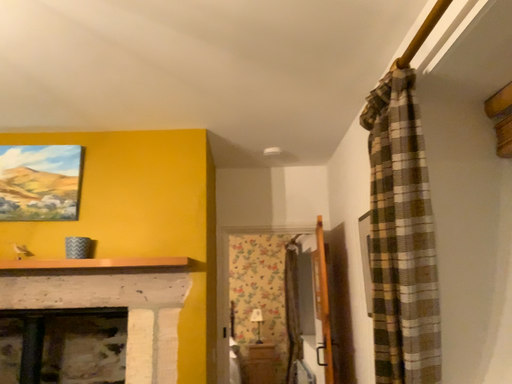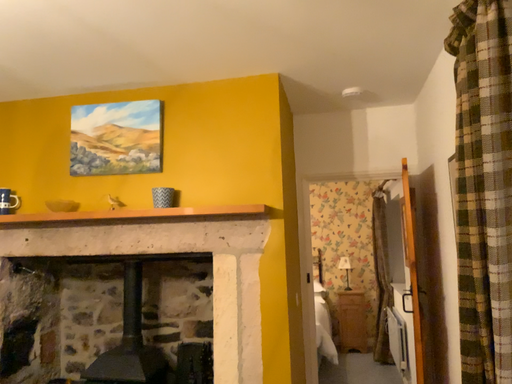
Question: Which way did the camera rotate in the video?

Choices:
 (A) rotated downward
 (B) rotated upward

Answer: (A)